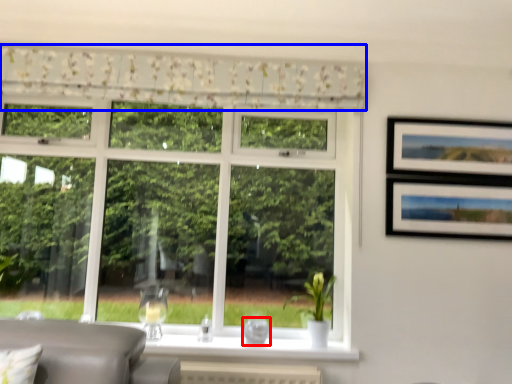
Question: Among these objects, which one is nearest to the camera, glass vase (highlighted by a red box) or curtain (highlighted by a blue box)?

Choices:
 (A) glass vase
 (B) curtain

Answer: (B)